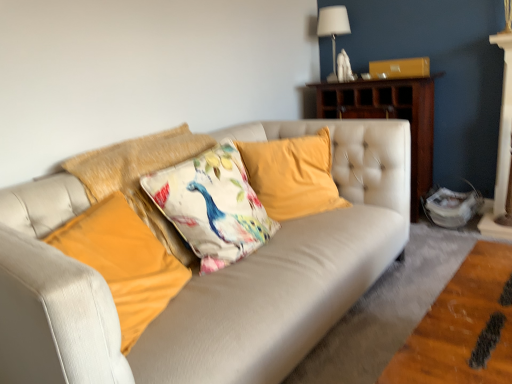
Identify the location of floral fabric cushion at center, the 3th pillow viewed from the left. 212,206.

Describe the element at coordinates (333, 28) in the screenshot. I see `white fabric lampshade at upper right` at that location.

What are the coordinates of `white fabric lampshade at upper right` in the screenshot? It's located at (333, 28).

The height and width of the screenshot is (384, 512). What do you see at coordinates (124, 262) in the screenshot?
I see `velvet orange pillow at center, which ranks as the 4th pillow in right-to-left order` at bounding box center [124, 262].

This screenshot has width=512, height=384. I want to click on wooden cabinet at upper right, so click(389, 116).

Who is shorter, velvet orange pillow at center, which ranks as the 4th pillow in right-to-left order, or floral fabric cushion at center, placed as the 2th pillow when sorted from left to right?

velvet orange pillow at center, which ranks as the 4th pillow in right-to-left order.

Considering their positions, is velvet orange pillow at center, the 1th pillow positioned from the left, located in front of or behind floral fabric cushion at center, placed as the 2th pillow when sorted from left to right?

In the image, velvet orange pillow at center, the 1th pillow positioned from the left, appears in front of floral fabric cushion at center, placed as the 2th pillow when sorted from left to right.

Considering the relative positions of velvet orange pillow at center, the 1th pillow positioned from the left, and floral fabric cushion at center, marked as the third pillow in a right-to-left arrangement, in the image provided, is velvet orange pillow at center, the 1th pillow positioned from the left, to the right of floral fabric cushion at center, marked as the third pillow in a right-to-left arrangement, from the viewer's perspective?

No.

Is velvet orange pillow at center, the 1th pillow positioned from the left, touching floral fabric cushion at center, placed as the 2th pillow when sorted from left to right?

No, velvet orange pillow at center, the 1th pillow positioned from the left, is not making contact with floral fabric cushion at center, placed as the 2th pillow when sorted from left to right.

Is velvet orange pillow at center, which ranks as the 4th pillow in right-to-left order, placed right next to velvet yellow pillow at center, which is the fourth pillow from left to right?

No.

Based on the photo, from a real-world perspective, who is located lower, velvet orange pillow at center, which ranks as the 4th pillow in right-to-left order, or velvet yellow pillow at center, which is the fourth pillow from left to right?

velvet orange pillow at center, which ranks as the 4th pillow in right-to-left order.

Which object is closer to the camera taking this photo, velvet orange pillow at center, which ranks as the 4th pillow in right-to-left order, or velvet yellow pillow at center, which is the fourth pillow from left to right?

velvet orange pillow at center, which ranks as the 4th pillow in right-to-left order, is more forward.

Between floral fabric cushion at center, marked as the third pillow in a right-to-left arrangement, and wooden cabinet at upper right, which one is positioned behind?

Positioned behind is wooden cabinet at upper right.

Does floral fabric cushion at center, marked as the third pillow in a right-to-left arrangement, have a larger size compared to wooden cabinet at upper right?

Actually, floral fabric cushion at center, marked as the third pillow in a right-to-left arrangement, might be smaller than wooden cabinet at upper right.

Considering the sizes of objects floral fabric cushion at center, marked as the third pillow in a right-to-left arrangement, and wooden cabinet at upper right in the image provided, who is thinner, floral fabric cushion at center, marked as the third pillow in a right-to-left arrangement, or wooden cabinet at upper right?

wooden cabinet at upper right.

Does point (190, 131) appear closer or farther from the camera than point (402, 93)?

Point (190, 131) is closer to the camera than point (402, 93).

Considering the relative sizes of velvet yellow pillow at center, arranged as the first pillow when viewed from the right, and velvet orange pillow at center, the 1th pillow positioned from the left, in the image provided, is velvet yellow pillow at center, arranged as the first pillow when viewed from the right, smaller than velvet orange pillow at center, the 1th pillow positioned from the left,?

Actually, velvet yellow pillow at center, arranged as the first pillow when viewed from the right, might be larger than velvet orange pillow at center, the 1th pillow positioned from the left.

Does velvet yellow pillow at center, which is the fourth pillow from left to right, turn towards velvet orange pillow at center, which ranks as the 4th pillow in right-to-left order?

No, velvet yellow pillow at center, which is the fourth pillow from left to right, is not facing towards velvet orange pillow at center, which ranks as the 4th pillow in right-to-left order.

Are velvet yellow pillow at center, which is the fourth pillow from left to right, and velvet orange pillow at center, which ranks as the 4th pillow in right-to-left order, making contact?

No, velvet yellow pillow at center, which is the fourth pillow from left to right, is not in contact with velvet orange pillow at center, which ranks as the 4th pillow in right-to-left order.

Which object is positioned more to the right, velvet yellow pillow at center, arranged as the first pillow when viewed from the right, or velvet orange pillow at center, which ranks as the 4th pillow in right-to-left order?

velvet yellow pillow at center, arranged as the first pillow when viewed from the right, is more to the right.

Considering the relative sizes of velvet yellow pillow at center, which is the fourth pillow from left to right, and floral fabric cushion at center, the 3th pillow viewed from the left, in the image provided, is velvet yellow pillow at center, which is the fourth pillow from left to right, wider than floral fabric cushion at center, the 3th pillow viewed from the left,?

In fact, velvet yellow pillow at center, which is the fourth pillow from left to right, might be narrower than floral fabric cushion at center, the 3th pillow viewed from the left.

Is velvet yellow pillow at center, which is the fourth pillow from left to right, facing away from floral fabric cushion at center, which is the 2th pillow from right to left?

velvet yellow pillow at center, which is the fourth pillow from left to right, does not have its back to floral fabric cushion at center, which is the 2th pillow from right to left.

From a real-world perspective, is velvet yellow pillow at center, which is the fourth pillow from left to right, below floral fabric cushion at center, the 3th pillow viewed from the left?

Yes, from a real-world perspective, velvet yellow pillow at center, which is the fourth pillow from left to right, is below floral fabric cushion at center, the 3th pillow viewed from the left.

Is velvet yellow pillow at center, arranged as the first pillow when viewed from the right, placed right next to floral fabric cushion at center, which is the 2th pillow from right to left?

velvet yellow pillow at center, arranged as the first pillow when viewed from the right, and floral fabric cushion at center, which is the 2th pillow from right to left, are not in contact.

Who is bigger, floral fabric cushion at center, placed as the 2th pillow when sorted from left to right, or velvet yellow pillow at center, which is the fourth pillow from left to right?

With larger size is floral fabric cushion at center, placed as the 2th pillow when sorted from left to right.

In the scene shown: Considering the positions of objects floral fabric cushion at center, placed as the 2th pillow when sorted from left to right, and velvet yellow pillow at center, arranged as the first pillow when viewed from the right, in the image provided, who is more to the left, floral fabric cushion at center, placed as the 2th pillow when sorted from left to right, or velvet yellow pillow at center, arranged as the first pillow when viewed from the right,?

Positioned to the left is floral fabric cushion at center, placed as the 2th pillow when sorted from left to right.

The width and height of the screenshot is (512, 384). In order to click on pillow located above the floral fabric cushion at center, marked as the third pillow in a right-to-left arrangement (from the image's perspective) in this screenshot , I will do `click(292, 175)`.

How much distance is there between floral fabric cushion at center, marked as the third pillow in a right-to-left arrangement, and velvet yellow pillow at center, arranged as the first pillow when viewed from the right?

floral fabric cushion at center, marked as the third pillow in a right-to-left arrangement, is 20.11 inches away from velvet yellow pillow at center, arranged as the first pillow when viewed from the right.

From the image's perspective, is wooden cabinet at upper right under floral fabric cushion at center, marked as the third pillow in a right-to-left arrangement?

No, from the image's perspective, wooden cabinet at upper right is not beneath floral fabric cushion at center, marked as the third pillow in a right-to-left arrangement.

Could you tell me if wooden cabinet at upper right is facing floral fabric cushion at center, marked as the third pillow in a right-to-left arrangement?

Yes.

Is point (428, 144) closer or farther from the camera than point (142, 208)?

Point (428, 144).

Relative to floral fabric cushion at center, marked as the third pillow in a right-to-left arrangement, is wooden cabinet at upper right in front or behind?

wooden cabinet at upper right is behind floral fabric cushion at center, marked as the third pillow in a right-to-left arrangement.

Locate an element on the screen. the 3rd pillow located above the velvet orange pillow at center, the 1th pillow positioned from the left (from a real-world perspective) is located at coordinates (140, 176).

From the image's perspective, starting from the velvet orange pillow at center, which ranks as the 4th pillow in right-to-left order, which pillow is the 3rd one above? Please provide its 2D coordinates.

[(292, 175)]

Considering their positions, is floral fabric cushion at center, placed as the 2th pillow when sorted from left to right, positioned further to floral fabric cushion at center, which is the 2th pillow from right to left, than white fabric lampshade at upper right?

white fabric lampshade at upper right lies further to floral fabric cushion at center, which is the 2th pillow from right to left, than the other object.

From the image, which object appears to be nearer to floral fabric cushion at center, placed as the 2th pillow when sorted from left to right, floral fabric cushion at center, the 3th pillow viewed from the left, or white fabric lampshade at upper right?

floral fabric cushion at center, the 3th pillow viewed from the left, lies closer to floral fabric cushion at center, placed as the 2th pillow when sorted from left to right, than the other object.

Estimate the real-world distances between objects in this image. Which object is further from floral fabric cushion at center, the 3th pillow viewed from the left, wooden cabinet at upper right or white fabric lampshade at upper right?

Among the two, white fabric lampshade at upper right is located further to floral fabric cushion at center, the 3th pillow viewed from the left.

Estimate the real-world distances between objects in this image. Which object is closer to floral fabric cushion at center, placed as the 2th pillow when sorted from left to right, wooden cabinet at upper right or white fabric lampshade at upper right?

Among the two, wooden cabinet at upper right is located nearer to floral fabric cushion at center, placed as the 2th pillow when sorted from left to right.

Which object lies further to the anchor point floral fabric cushion at center, which is the 2th pillow from right to left, velvet orange pillow at center, the 1th pillow positioned from the left, or floral fabric cushion at center, placed as the 2th pillow when sorted from left to right?

The object further to floral fabric cushion at center, which is the 2th pillow from right to left, is velvet orange pillow at center, the 1th pillow positioned from the left.

Based on their spatial positions, is floral fabric cushion at center, marked as the third pillow in a right-to-left arrangement, or floral fabric cushion at center, which is the 2th pillow from right to left, closer to velvet orange pillow at center, which ranks as the 4th pillow in right-to-left order?

floral fabric cushion at center, marked as the third pillow in a right-to-left arrangement, is closer to velvet orange pillow at center, which ranks as the 4th pillow in right-to-left order.

Which object lies further to the anchor point floral fabric cushion at center, placed as the 2th pillow when sorted from left to right, white fabric lampshade at upper right or velvet orange pillow at center, which ranks as the 4th pillow in right-to-left order?

white fabric lampshade at upper right.

Estimate the real-world distances between objects in this image. Which object is closer to floral fabric cushion at center, marked as the third pillow in a right-to-left arrangement, velvet orange pillow at center, the 1th pillow positioned from the left, or velvet yellow pillow at center, which is the fourth pillow from left to right?

The object closer to floral fabric cushion at center, marked as the third pillow in a right-to-left arrangement, is velvet orange pillow at center, the 1th pillow positioned from the left.

Image resolution: width=512 pixels, height=384 pixels. Find the location of `dresser between velvet orange pillow at center, the 1th pillow positioned from the left, and white fabric lampshade at upper right in the front-back direction`. dresser between velvet orange pillow at center, the 1th pillow positioned from the left, and white fabric lampshade at upper right in the front-back direction is located at coordinates (389, 116).

At what (x,y) coordinates should I click in order to perform the action: click on dresser between floral fabric cushion at center, the 3th pillow viewed from the left, and white fabric lampshade at upper right, along the z-axis. Please return your answer as a coordinate pair (x, y). The image size is (512, 384). Looking at the image, I should click on (389, 116).

Where is `dresser between floral fabric cushion at center, marked as the third pillow in a right-to-left arrangement, and white fabric lampshade at upper right, along the z-axis`? The image size is (512, 384). dresser between floral fabric cushion at center, marked as the third pillow in a right-to-left arrangement, and white fabric lampshade at upper right, along the z-axis is located at coordinates coord(389,116).

Where is `pillow positioned between velvet orange pillow at center, which ranks as the 4th pillow in right-to-left order, and floral fabric cushion at center, marked as the third pillow in a right-to-left arrangement, from near to far`? The height and width of the screenshot is (384, 512). pillow positioned between velvet orange pillow at center, which ranks as the 4th pillow in right-to-left order, and floral fabric cushion at center, marked as the third pillow in a right-to-left arrangement, from near to far is located at coordinates (212, 206).